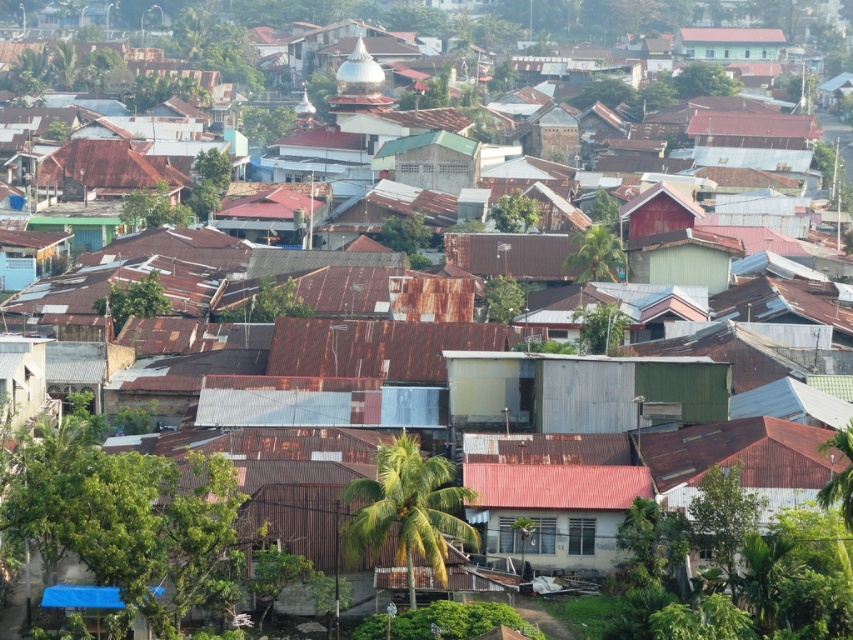
Question: Estimate the real-world distances between objects in this image. Which object is farther from the rusty metal hut at upper left?

Choices:
 (A) green corrugated metal building at upper center
 (B) green corrugated metal hut at center

Answer: (A)

Question: Can you confirm if rusty metal hut at upper left is positioned below green corrugated metal building at upper center?

Choices:
 (A) no
 (B) yes

Answer: (B)

Question: Which of the following is the farthest from the observer?

Choices:
 (A) rusty metal hut at upper left
 (B) green corrugated metal building at upper center
 (C) green corrugated metal hut at center

Answer: (B)

Question: Does green corrugated metal hut at center appear on the right side of green corrugated metal building at upper center?

Choices:
 (A) no
 (B) yes

Answer: (A)

Question: Is green corrugated metal hut at center wider than green corrugated metal building at upper center?

Choices:
 (A) no
 (B) yes

Answer: (A)

Question: Among these points, which one is nearest to the camera?

Choices:
 (A) (733, 35)
 (B) (595, 372)
 (C) (45, 182)

Answer: (B)